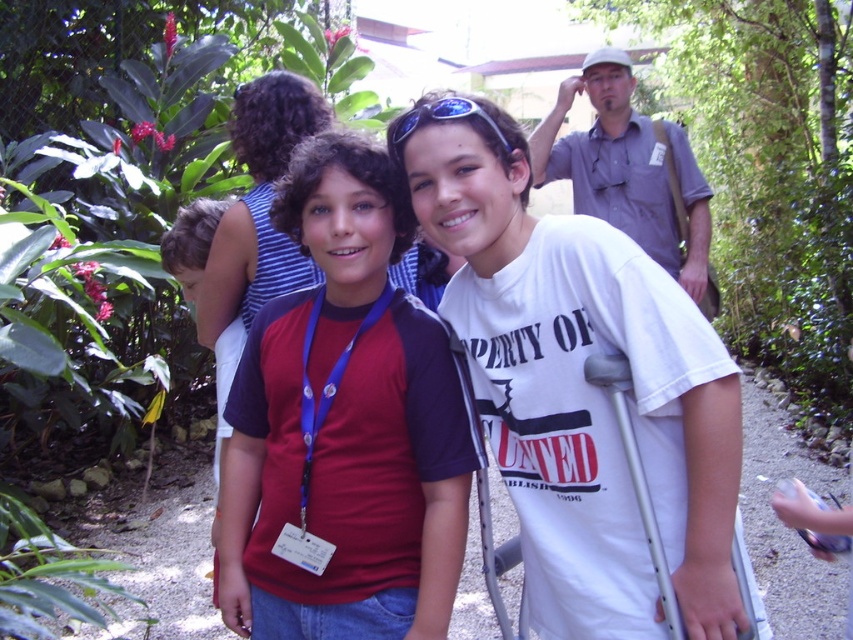
You are a photographer trying to capture a clear shot of the gray shirt at upper center and the blue reflective sunglasses at center. Since you want both subjects to be in focus, which one should you adjust your camera focus on first?

The gray shirt at upper center is taller than blue reflective sunglasses at center, so you should focus on the gray shirt at upper center first because it is closer to the camera.

You are a photographer standing in the garden and want to take a photo of the gray shirt at upper center and the blue reflective sunglasses at center. Which object should you focus on first to ensure it appears sharp in the photo?

You should focus on the gray shirt at upper center first because it is closer to you than the blue reflective sunglasses at center, so focusing on it will keep it sharp while the sunglasses may appear slightly out of focus due to the distance difference.